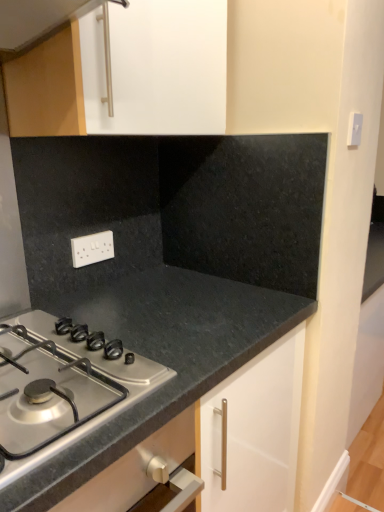
Question: Is point (104, 230) positioned closer to the camera than point (200, 364)?

Choices:
 (A) farther
 (B) closer

Answer: (A)

Question: In terms of width, does white plastic electric outlet at center look wider or thinner when compared to black granite countertop at center?

Choices:
 (A) thin
 (B) wide

Answer: (A)

Question: Estimate the real-world distances between objects in this image. Which object is farther from the white plastic electric outlet at center?

Choices:
 (A) satin silver gas stove at lower left
 (B) black granite countertop at center

Answer: (A)

Question: Estimate the real-world distances between objects in this image. Which object is farther from the satin silver gas stove at lower left?

Choices:
 (A) white plastic electric outlet at center
 (B) black granite countertop at center

Answer: (A)